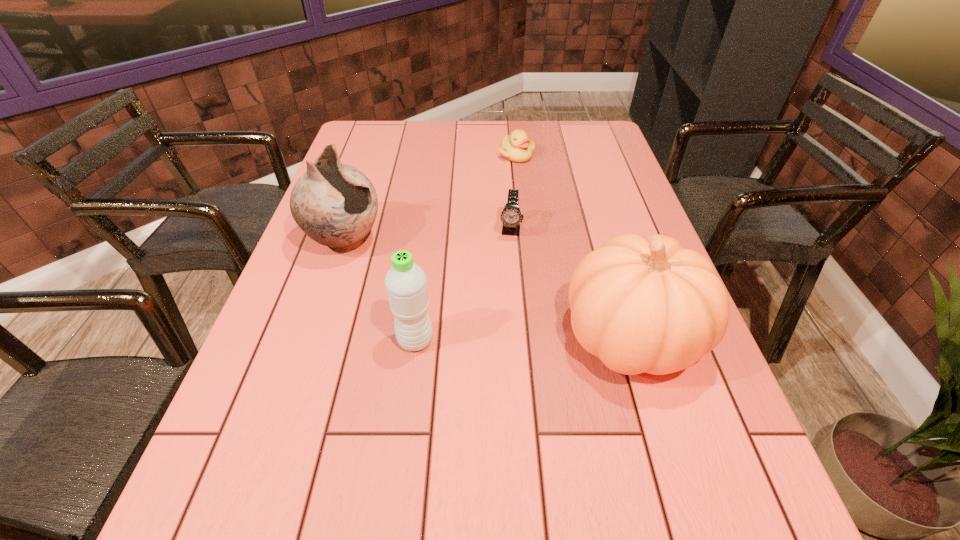
Where is `the fourth object from right to left`? This screenshot has height=540, width=960. the fourth object from right to left is located at coordinates (405, 282).

Locate an element on the screen. pumpkin is located at coordinates (640, 304).

The height and width of the screenshot is (540, 960). I want to click on duckling, so click(x=518, y=148).

Identify the location of the farthest object. (518, 148).

You are a GUI agent. You are given a task and a screenshot of the screen. Output one action in this format:
    pyautogui.click(x=<x>, y=<y>)
    Task: Click on the leftmost object
    The height and width of the screenshot is (540, 960).
    Given the screenshot: What is the action you would take?
    pyautogui.click(x=335, y=204)

Find the location of a particular element. The image size is (960, 540). watch is located at coordinates (511, 216).

I want to click on vacant region located 0.400m on the right of the second object from left to right, so click(x=622, y=340).

Identify the location of free location located 0.280m on the back of the pumpkin. This screenshot has width=960, height=540. (594, 216).

The width and height of the screenshot is (960, 540). Find the location of `blank area located 0.130m on the front-facing side of the farthest object`. blank area located 0.130m on the front-facing side of the farthest object is located at coordinates (518, 187).

Where is `vacant space situated on the front-facing side of the farthest object`? vacant space situated on the front-facing side of the farthest object is located at coordinates (518, 194).